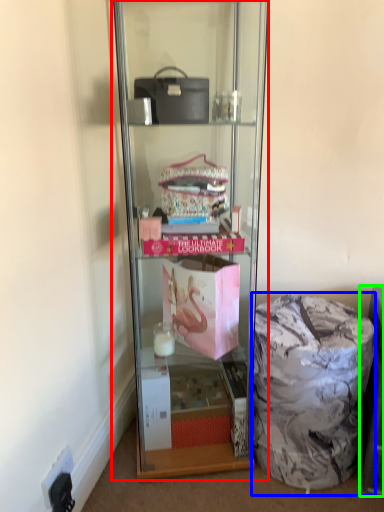
Question: Estimate the real-world distances between objects in this image. Which object is farther from shelf (highlighted by a red box), garbage (highlighted by a blue box) or cabinet (highlighted by a green box)?

Choices:
 (A) garbage
 (B) cabinet

Answer: (B)